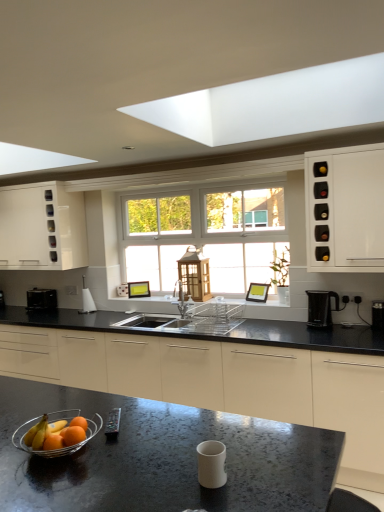
Where is `vacant space in front of white glossy trash can at left, the 4th appliance in the front-to-back sequence`? vacant space in front of white glossy trash can at left, the 4th appliance in the front-to-back sequence is located at coordinates (91, 314).